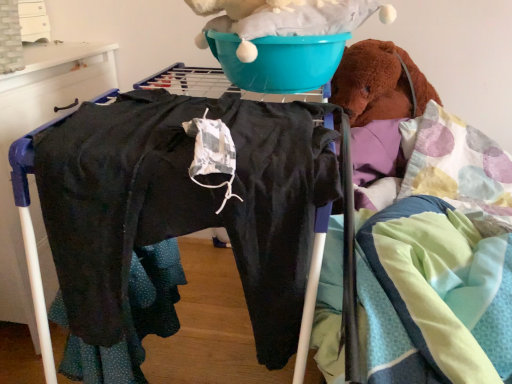
Question: Should I look upward or downward to see dark gray fabric pants at left?

Choices:
 (A) down
 (B) up

Answer: (B)

Question: From a real-world perspective, is dark gray fabric pants at left located beneath teal plastic basin at upper center?

Choices:
 (A) yes
 (B) no

Answer: (A)

Question: Does dark gray fabric pants at left contain teal plastic basin at upper center?

Choices:
 (A) no
 (B) yes

Answer: (A)

Question: Does dark gray fabric pants at left have a greater width compared to teal plastic basin at upper center?

Choices:
 (A) no
 (B) yes

Answer: (B)

Question: Is dark gray fabric pants at left at the right side of teal plastic basin at upper center?

Choices:
 (A) yes
 (B) no

Answer: (B)

Question: Is dark gray fabric pants at left looking in the opposite direction of teal plastic basin at upper center?

Choices:
 (A) yes
 (B) no

Answer: (B)

Question: From the image's perspective, is dark gray fabric pants at left located beneath teal plastic basin at upper center?

Choices:
 (A) yes
 (B) no

Answer: (A)

Question: Considering the relative positions of teal plastic basin at upper center and dark gray fabric pants at left in the image provided, is teal plastic basin at upper center to the left of dark gray fabric pants at left from the viewer's perspective?

Choices:
 (A) no
 (B) yes

Answer: (A)

Question: From the image's perspective, is teal plastic basin at upper center above dark gray fabric pants at left?

Choices:
 (A) yes
 (B) no

Answer: (A)

Question: Is teal plastic basin at upper center further to camera compared to dark gray fabric pants at left?

Choices:
 (A) no
 (B) yes

Answer: (A)

Question: Is teal plastic basin at upper center directly adjacent to dark gray fabric pants at left?

Choices:
 (A) yes
 (B) no

Answer: (B)

Question: Is dark gray fabric pants at left located within teal plastic basin at upper center?

Choices:
 (A) no
 (B) yes

Answer: (A)

Question: From the image's perspective, is teal plastic basin at upper center beneath dark gray fabric pants at left?

Choices:
 (A) no
 (B) yes

Answer: (A)

Question: Is point (6, 259) closer or farther from the camera than point (286, 69)?

Choices:
 (A) closer
 (B) farther

Answer: (B)